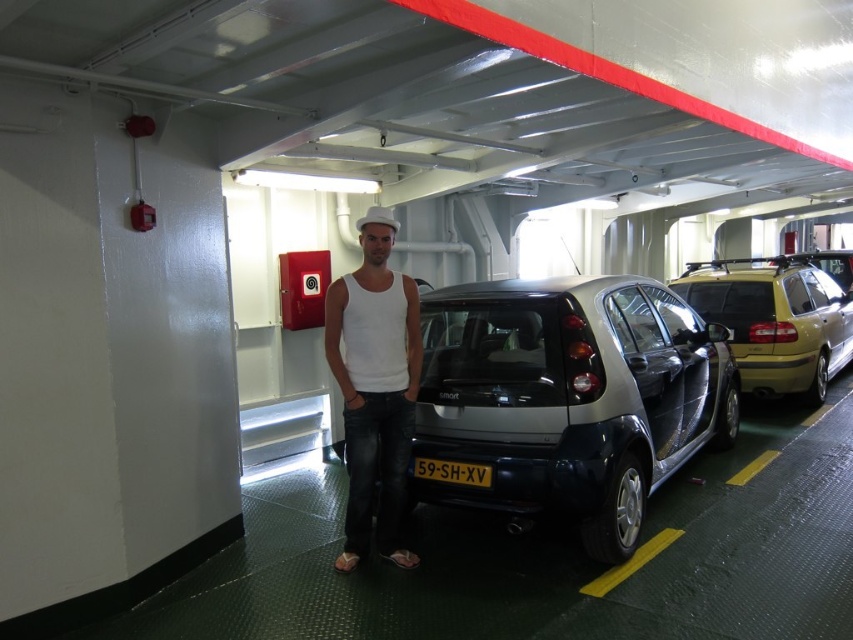
Between point (732, 340) and point (471, 480), which one is positioned in front?

Positioned in front is point (471, 480).

Who is more distant from viewer, [711,285] or [422,472]?

The point [711,285] is behind.

Locate an element on the screen. The width and height of the screenshot is (853, 640). metallic gold suv at right is located at coordinates (775, 321).

Which of these two, white matte tank top at center or black plastic license plate at center, stands shorter?

With less height is black plastic license plate at center.

Can you confirm if white matte tank top at center is bigger than black plastic license plate at center?

Yes.

Between point (376, 256) and point (424, 465), which one is positioned in front?

Point (376, 256) is more forward.

The image size is (853, 640). In order to click on white matte tank top at center in this screenshot , I will do `click(374, 387)`.

Measure the distance between metallic silver car at center and white matte tank top at center.

metallic silver car at center is 1.16 meters from white matte tank top at center.

Locate an element on the screen. The image size is (853, 640). metallic silver car at center is located at coordinates (569, 397).

Who is more forward, (427, 372) or (358, 435)?

Positioned in front is point (358, 435).

Where is `metallic silver car at center`? The height and width of the screenshot is (640, 853). metallic silver car at center is located at coordinates (569, 397).